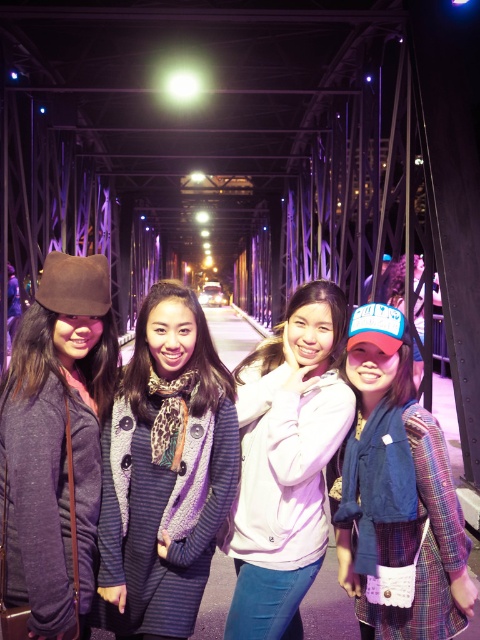
You are a photographer trying to capture a group photo of the blue fabric cap at right and the pink fleece jacket at center. Based on their heights, which object should you focus on first to ensure both are in frame?

The blue fabric cap at right has a lesser height compared to the pink fleece jacket at center, so focus on the pink fleece jacket at center first to ensure both are in frame.

You are a photographer positioned at the center of the bridge. You want to capture a photo of the blue fabric cap at right. Based on its coordinates, will the cap be in the left or right half of the photo?

The blue fabric cap at right is located at point 0.769 on the x and 0.827 on the y. Since the x coordinate is greater than 0.5, it will be in the right half of the photo.

You are taking a photo of the scene and want to focus on both point (195, 602) and point (324, 365). Which point should you adjust your focus to first to ensure the closer one is sharp?

Point (195, 602) is closer to the camera than point (324, 365), so you should focus on point (195, 602) first to ensure the closer one is sharp.